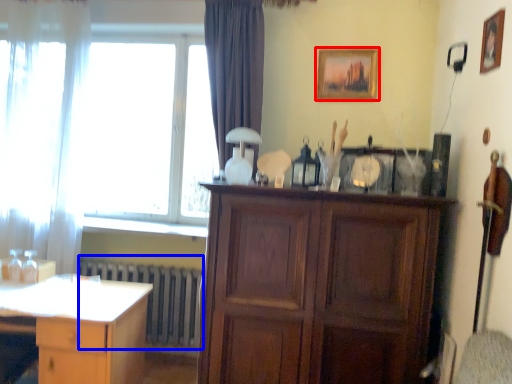
Question: Which of the following is the closest to the observer, picture frame (highlighted by a red box) or radiator (highlighted by a blue box)?

Choices:
 (A) picture frame
 (B) radiator

Answer: (A)